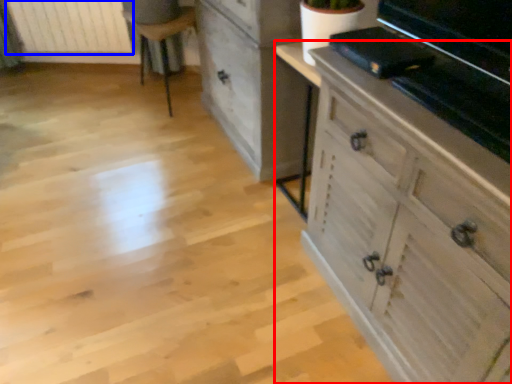
Question: Among these objects, which one is farthest to the camera, chest of drawers (highlighted by a red box) or radiator (highlighted by a blue box)?

Choices:
 (A) chest of drawers
 (B) radiator

Answer: (B)